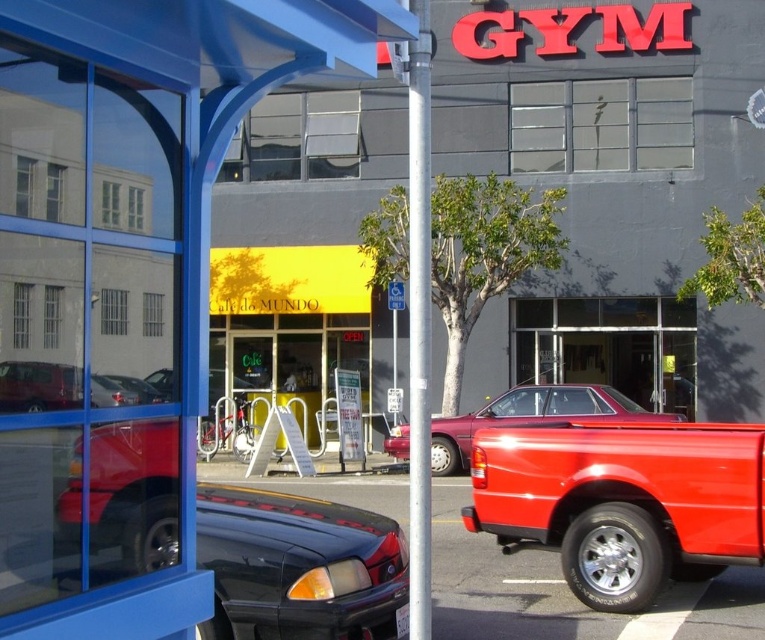
Question: Among these objects, which one is farthest from the camera?

Choices:
 (A) shiny black sedan at center
 (B) glossy black car at center
 (C) metallic gray pole at center
 (D) shiny red pickup truck at center

Answer: (D)

Question: Is shiny red pickup truck at right closer to the viewer compared to metallic gray pole at center?

Choices:
 (A) no
 (B) yes

Answer: (A)

Question: Does shiny red pickup truck at right have a smaller size compared to glossy black car at center?

Choices:
 (A) no
 (B) yes

Answer: (A)

Question: Can you confirm if shiny red pickup truck at right is wider than shiny black sedan at center?

Choices:
 (A) no
 (B) yes

Answer: (B)

Question: Which is nearer to the shiny black sedan at center?

Choices:
 (A) glossy black car at center
 (B) shiny red pickup truck at right
 (C) metallic gray pole at center

Answer: (C)

Question: Which point is farther to the camera?

Choices:
 (A) metallic gray pole at center
 (B) matte red truck at left
 (C) shiny red pickup truck at right
 (D) glossy black car at center

Answer: (C)